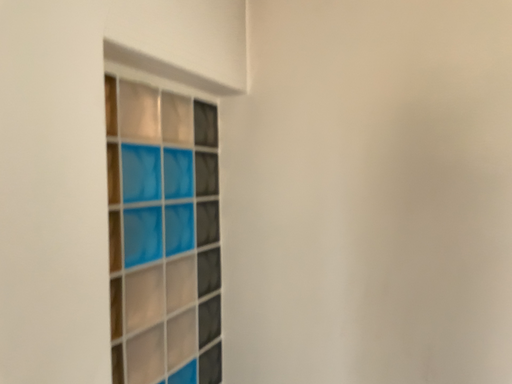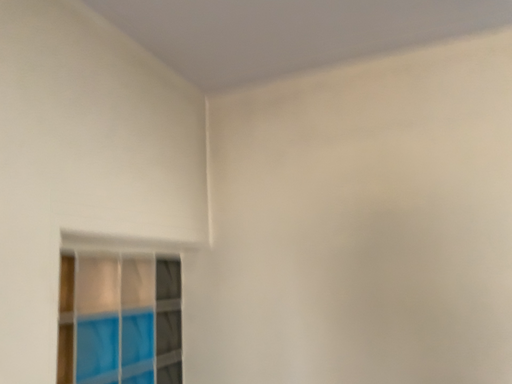
Question: How did the camera likely rotate when shooting the video?

Choices:
 (A) rotated upward
 (B) rotated downward

Answer: (A)